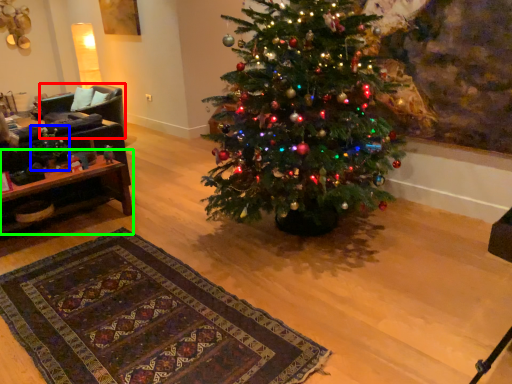
Question: Based on their relative distances, which object is farther from armchair (highlighted by a red box)? Choose from christmas decoration (highlighted by a blue box) and table (highlighted by a green box).

Choices:
 (A) christmas decoration
 (B) table

Answer: (B)